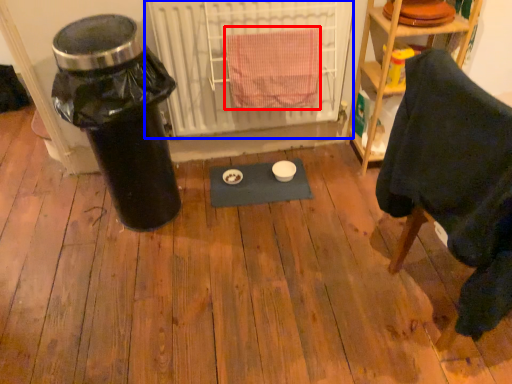
Question: Which object is further to the camera taking this photo, bath towel (highlighted by a red box) or radiator (highlighted by a blue box)?

Choices:
 (A) bath towel
 (B) radiator

Answer: (B)